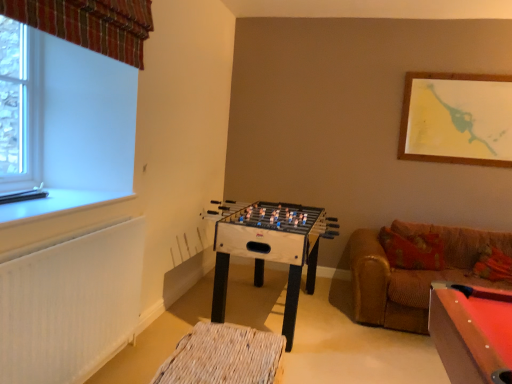
Question: Can you see plaid fabric curtain at upper left touching white plastic window sill at left?

Choices:
 (A) yes
 (B) no

Answer: (B)

Question: Is plaid fabric curtain at upper left wider than white plastic window sill at left?

Choices:
 (A) no
 (B) yes

Answer: (A)

Question: Can you confirm if plaid fabric curtain at upper left is taller than white plastic window sill at left?

Choices:
 (A) yes
 (B) no

Answer: (A)

Question: Is white plastic window sill at left completely or partially inside plaid fabric curtain at upper left?

Choices:
 (A) yes
 (B) no

Answer: (B)

Question: Is plaid fabric curtain at upper left at the right side of white plastic window sill at left?

Choices:
 (A) no
 (B) yes

Answer: (B)

Question: Which is correct: woven wood footrest at lower center is inside wooden foosball table at center, or outside of it?

Choices:
 (A) inside
 (B) outside

Answer: (B)

Question: From a real-world perspective, is woven wood footrest at lower center physically located above or below wooden foosball table at center?

Choices:
 (A) below
 (B) above

Answer: (A)

Question: From the image's perspective, is woven wood footrest at lower center located above or below wooden foosball table at center?

Choices:
 (A) above
 (B) below

Answer: (B)

Question: Is woven wood footrest at lower center bigger or smaller than wooden foosball table at center?

Choices:
 (A) big
 (B) small

Answer: (B)

Question: Would you say clear glass window at upper left is to the left or to the right of white plastic window sill at left in the picture?

Choices:
 (A) left
 (B) right

Answer: (A)

Question: Considering the positions of clear glass window at upper left and white plastic window sill at left in the image, is clear glass window at upper left wider or thinner than white plastic window sill at left?

Choices:
 (A) wide
 (B) thin

Answer: (B)

Question: Considering their positions, is clear glass window at upper left located in front of or behind white plastic window sill at left?

Choices:
 (A) front
 (B) behind

Answer: (B)

Question: Is point (20, 84) closer or farther from the camera than point (51, 192)?

Choices:
 (A) closer
 (B) farther

Answer: (B)

Question: From the image's perspective, is white textured radiator at lower left above or below plaid fabric curtain at upper left?

Choices:
 (A) above
 (B) below

Answer: (B)

Question: Considering the relative positions of white textured radiator at lower left and plaid fabric curtain at upper left in the image provided, is white textured radiator at lower left to the left or to the right of plaid fabric curtain at upper left?

Choices:
 (A) right
 (B) left

Answer: (B)